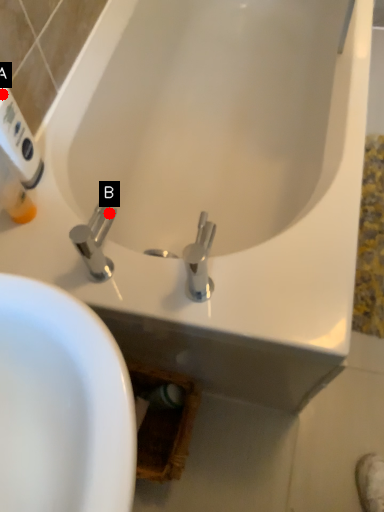
Question: Two points are circled on the image, labeled by A and B beside each circle. Which point appears farthest from the camera in this image?

Choices:
 (A) A is further
 (B) B is further

Answer: (B)